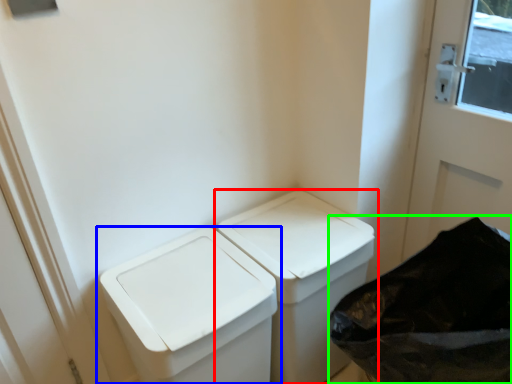
Question: Estimate the real-world distances between objects in this image. Which object is closer to waste container (highlighted by a red box), waste container (highlighted by a blue box) or recycling bin (highlighted by a green box)?

Choices:
 (A) waste container
 (B) recycling bin

Answer: (A)